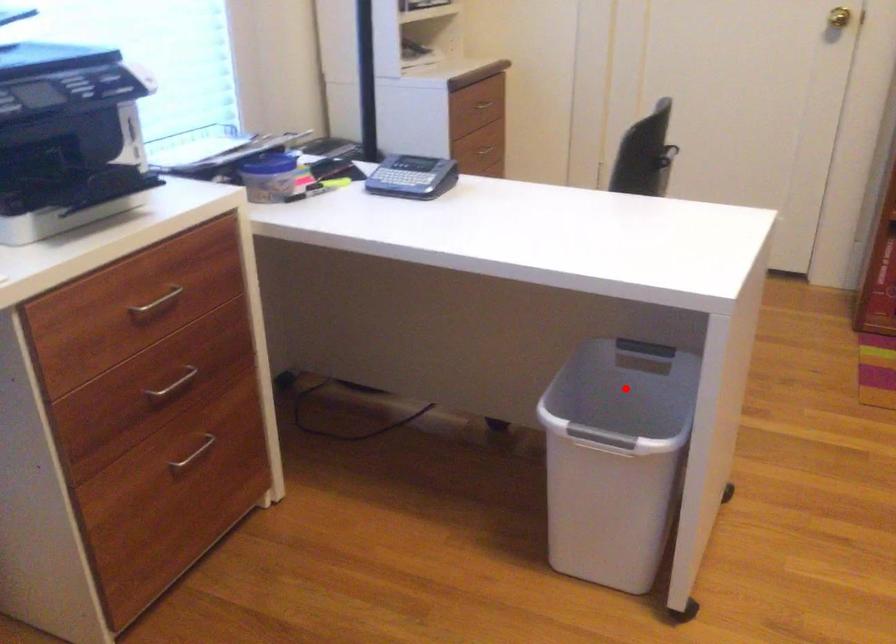
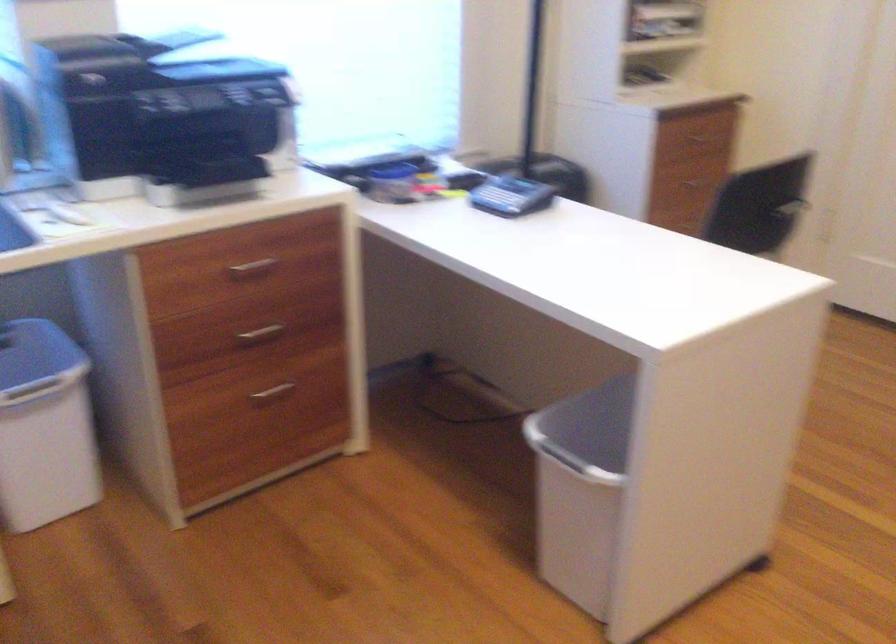
Question: I am providing you with two images of the same scene from different viewpoints. A red point is marked on the first image. Can you still see the location of the red point in image 2?

Choices:
 (A) Yes
 (B) No

Answer: (B)